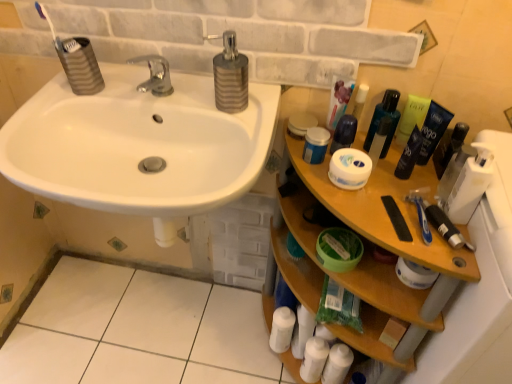
At what (x,y) coordinates should I click in order to perform the action: click on free space above wooden shelf at right (from a real-world perspective). Please return your answer as a coordinate pair (x, y). Looking at the image, I should click on (387, 196).